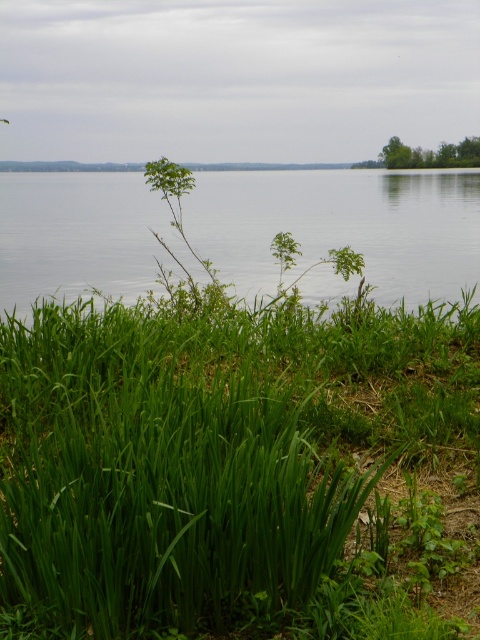
You are standing at the center of the lakeside scene. There is a green leafy grass at lower left located at point (227, 460). Can you tell me the exact coordinates of the green leafy grass at lower left?

The green leafy grass at lower left is located at point (227, 460).

You are standing at the lakeside and see a point marked on the image. What object is located at the coordinates point (227,460)?

The point (227,460) indicates green leafy grass at lower left.

You are a gardener who wants to plant a new flower that requires tall grasses for support. Looking at the image, which area between the green leafy grass at lower left and the green grass at upper right would be more suitable for planting your flower?

The green leafy grass at lower left is taller than the green grass at upper right, so it would be more suitable for planting the flower that requires tall grasses for support.